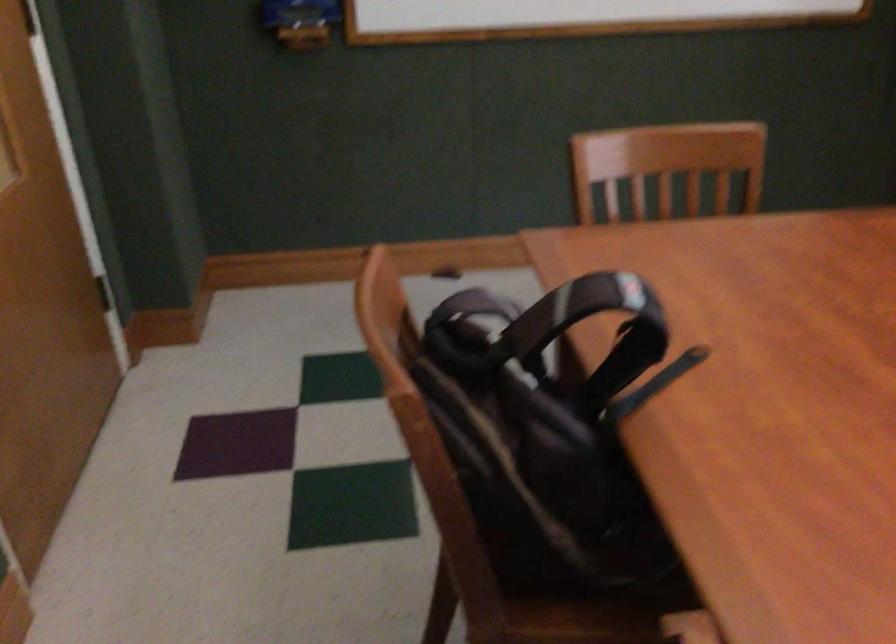
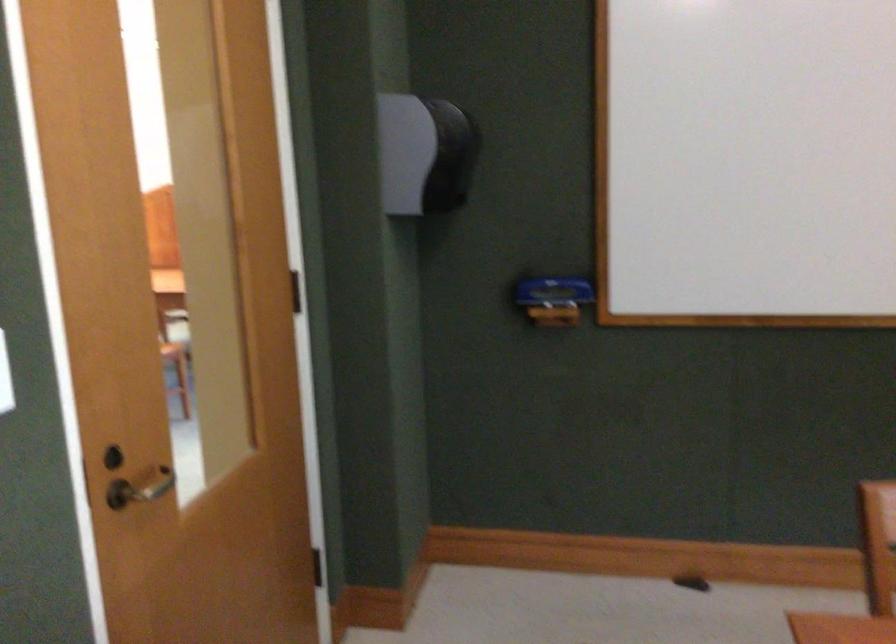
Based on the continuous images, in which direction is the camera rotating?

The rotation direction of the camera is left-up.